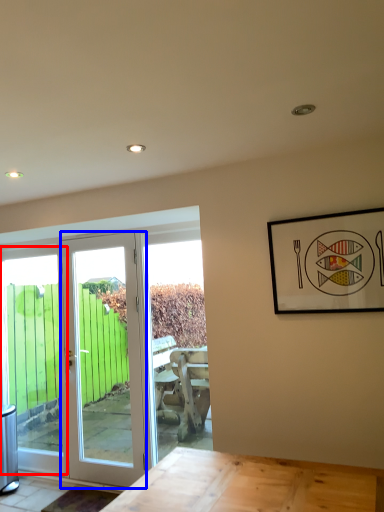
Question: Which object is closer to the camera taking this photo, window (highlighted by a red box) or door (highlighted by a blue box)?

Choices:
 (A) window
 (B) door

Answer: (B)